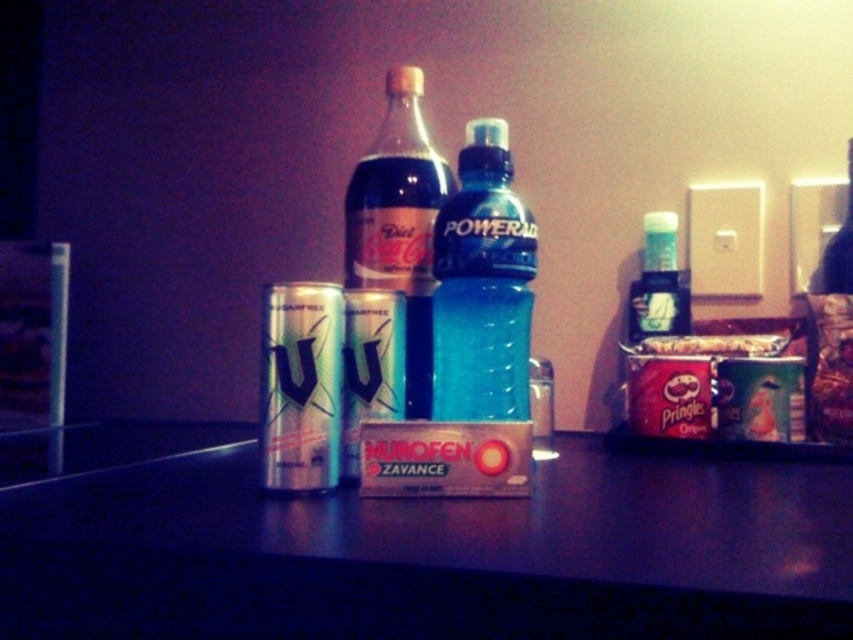
Measure the distance between blue translucent bottle at center and translucent plastic bottle at right.

They are 12.32 inches apart.

Which of these two, blue translucent bottle at center or translucent plastic bottle at right, stands shorter?

Standing shorter between the two is translucent plastic bottle at right.

At what (x,y) coordinates should I click in order to perform the action: click on blue translucent bottle at center. Please return your answer as a coordinate pair (x, y). Looking at the image, I should click on (482, 285).

The width and height of the screenshot is (853, 640). Find the location of `blue translucent bottle at center`. blue translucent bottle at center is located at coordinates (482, 285).

Can you confirm if diet coke glass bottle at center is positioned below translucent plastic bottle at right?

No, diet coke glass bottle at center is not below translucent plastic bottle at right.

What do you see at coordinates (399, 221) in the screenshot? This screenshot has width=853, height=640. I see `diet coke glass bottle at center` at bounding box center [399, 221].

Which is behind, point (425, 292) or point (647, 316)?

The point (647, 316) is behind.

The image size is (853, 640). Find the location of `diet coke glass bottle at center`. diet coke glass bottle at center is located at coordinates (399, 221).

Can you confirm if metallic silver table at center is bigger than blue translucent bottle at center?

Indeed, metallic silver table at center has a larger size compared to blue translucent bottle at center.

Who is shorter, metallic silver table at center or blue translucent bottle at center?

metallic silver table at center is shorter.

Does point (444, 580) lie behind point (486, 316)?

No.

Locate an element on the screen. The image size is (853, 640). metallic silver table at center is located at coordinates (434, 554).